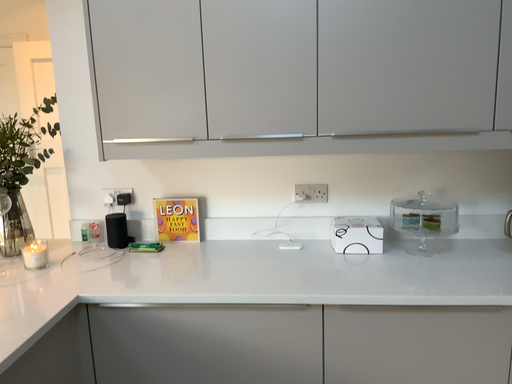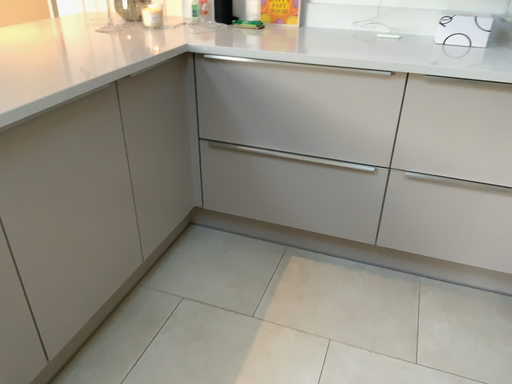
Question: Which way did the camera rotate in the video?

Choices:
 (A) rotated upward
 (B) rotated downward

Answer: (B)